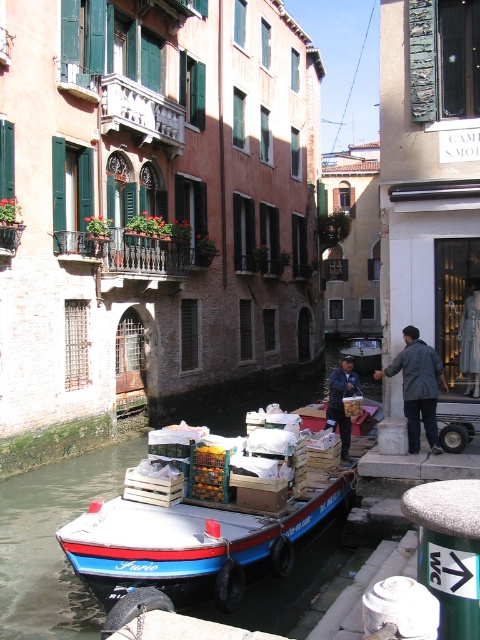
You are standing at the point with coordinates (197, 541) in the Venice canal scene. What object is located exactly at that point?

The blue painted wooden boat at center is located exactly at point (197, 541).

From the picture: You are a tourist in Venice and want to take a photo of the blue painted wooden boat at center and the blue wooden boat at center. However, you notice that one of them is smaller in size. Which boat should you focus on to ensure you capture the larger vessel in your shot?

The blue painted wooden boat at center occupies less space than blue wooden boat at center, so you should focus on the blue wooden boat at center to capture the larger vessel.